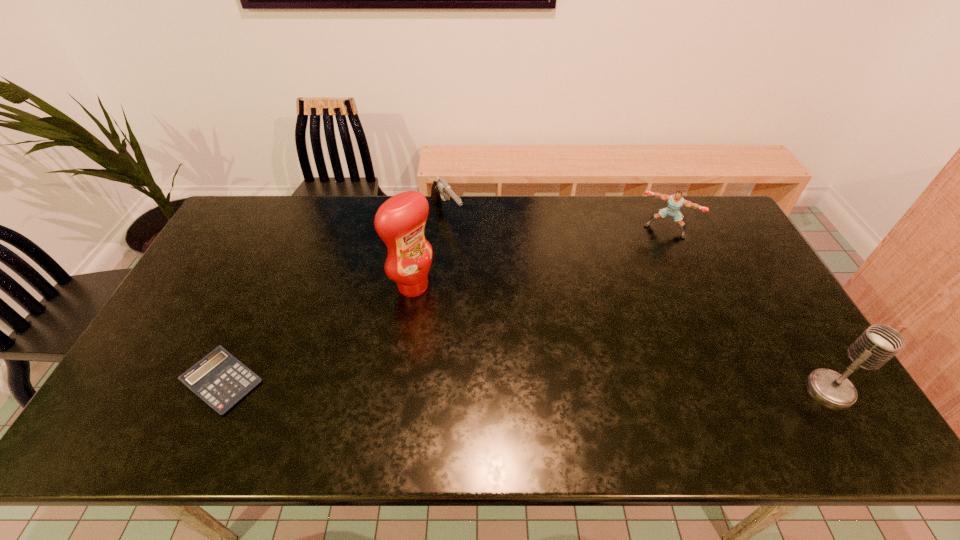
Locate an element on the screen. This screenshot has height=540, width=960. free space between the microphone and the condiment is located at coordinates (622, 338).

This screenshot has height=540, width=960. I want to click on the second closest object to the shortest object, so click(440, 189).

Point out which object is positioned as the fourth nearest to the microphone. Please provide its 2D coordinates. Your answer should be formatted as a tuple, i.e. [(x, y)], where the tuple contains the x and y coordinates of a point satisfying the conditions above.

[(219, 379)]

Locate an element on the screen. free space that satisfies the following two spatial constraints: 1. on the front side of the second tallest object; 2. on the right side of the puncher is located at coordinates (737, 389).